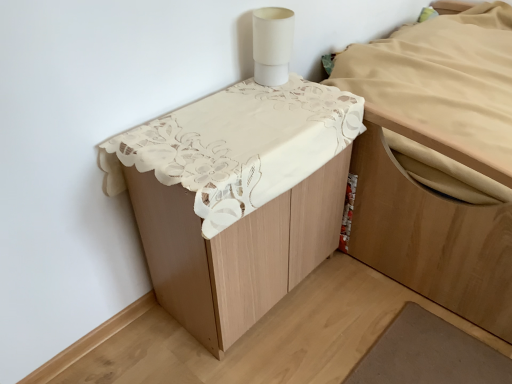
Question: Is white matte cylindrical lamp at upper right not inside white lace tablecloth at upper center, the 1th furniture from the left?

Choices:
 (A) yes
 (B) no

Answer: (A)

Question: Is white matte cylindrical lamp at upper right bigger than white lace tablecloth at upper center, the 1th furniture from the left?

Choices:
 (A) yes
 (B) no

Answer: (B)

Question: Is white matte cylindrical lamp at upper right placed right next to white lace tablecloth at upper center, acting as the second furniture starting from the right?

Choices:
 (A) yes
 (B) no

Answer: (B)

Question: Is white matte cylindrical lamp at upper right positioned far away from white lace tablecloth at upper center, the 1th furniture from the left?

Choices:
 (A) no
 (B) yes

Answer: (A)

Question: Can white lace tablecloth at upper center, acting as the second furniture starting from the right, be found inside white matte cylindrical lamp at upper right?

Choices:
 (A) yes
 (B) no

Answer: (B)

Question: In the image, is light brown wood bed at upper right, the first furniture when ordered from right to left, positioned in front of or behind white matte cylindrical lamp at upper right?

Choices:
 (A) behind
 (B) front

Answer: (B)

Question: Does point (393, 185) appear closer or farther from the camera than point (288, 29)?

Choices:
 (A) farther
 (B) closer

Answer: (A)

Question: Based on their sizes in the image, would you say light brown wood bed at upper right, the second furniture from the left, is bigger or smaller than white matte cylindrical lamp at upper right?

Choices:
 (A) big
 (B) small

Answer: (A)

Question: From a real-world perspective, is light brown wood bed at upper right, the first furniture when ordered from right to left, positioned above or below white matte cylindrical lamp at upper right?

Choices:
 (A) below
 (B) above

Answer: (A)

Question: Is point (508, 269) closer or farther from the camera than point (202, 180)?

Choices:
 (A) closer
 (B) farther

Answer: (B)

Question: Would you say light brown wood bed at upper right, the first furniture when ordered from right to left, is to the left or to the right of white lace tablecloth at upper center, the 1th furniture from the left, in the picture?

Choices:
 (A) left
 (B) right

Answer: (B)

Question: From the image's perspective, is light brown wood bed at upper right, the second furniture from the left, above or below white lace tablecloth at upper center, acting as the second furniture starting from the right?

Choices:
 (A) below
 (B) above

Answer: (B)

Question: From a real-world perspective, is light brown wood bed at upper right, the second furniture from the left, physically located above or below white lace tablecloth at upper center, the 1th furniture from the left?

Choices:
 (A) above
 (B) below

Answer: (A)

Question: From a real-world perspective, is white lace tablecloth at upper center, the 1th furniture from the left, physically located above or below light brown wood bed at upper right, the first furniture when ordered from right to left?

Choices:
 (A) below
 (B) above

Answer: (A)

Question: Relative to light brown wood bed at upper right, the second furniture from the left, is white lace tablecloth at upper center, the 1th furniture from the left, in front or behind?

Choices:
 (A) front
 (B) behind

Answer: (A)